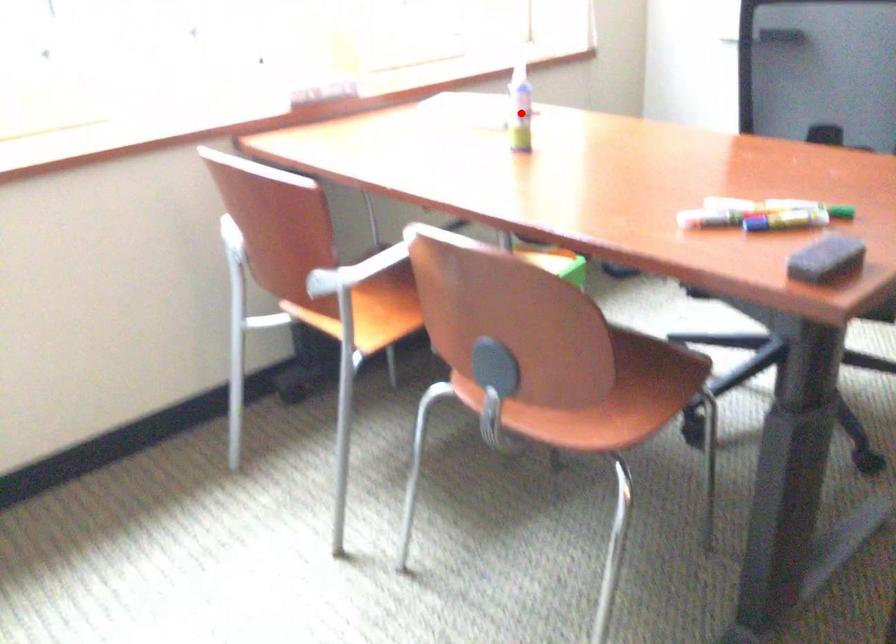
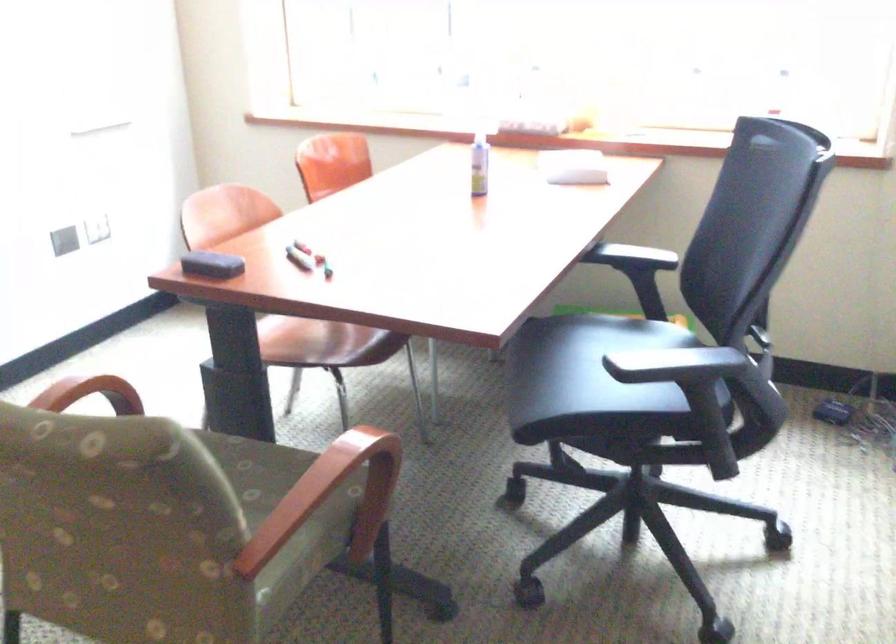
Question: I am providing you with two images of the same scene from different viewpoints. A red point is shown in image1. For the corresponding object point in image2, is it positioned nearer or farther from the camera?

Choices:
 (A) Nearer
 (B) Farther

Answer: (B)